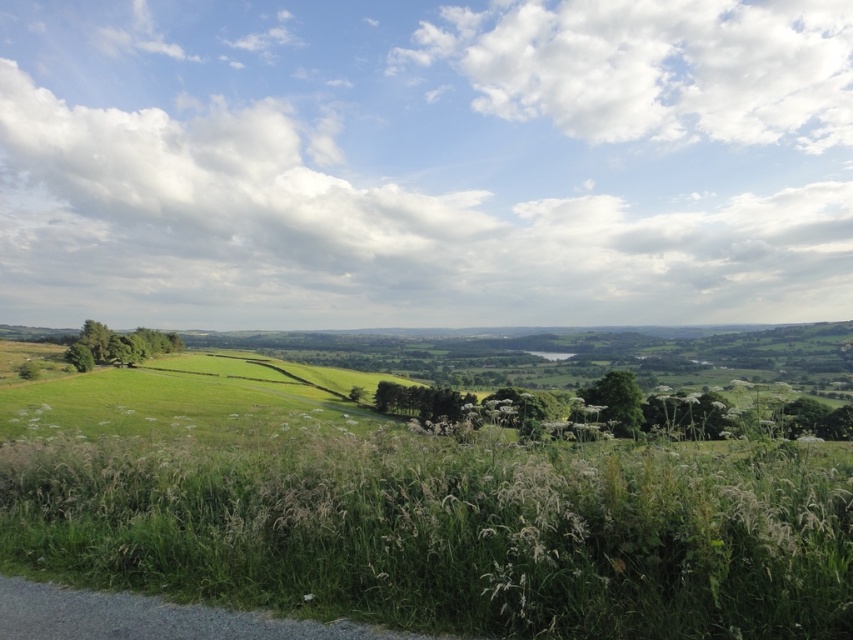
Between green grassy at lower center and green grassy field at lower left, which one is positioned higher?

green grassy at lower center

Locate an element on the screen. This screenshot has height=640, width=853. green grassy at lower center is located at coordinates (450, 532).

Identify the location of green grassy at lower center. The height and width of the screenshot is (640, 853). (450, 532).